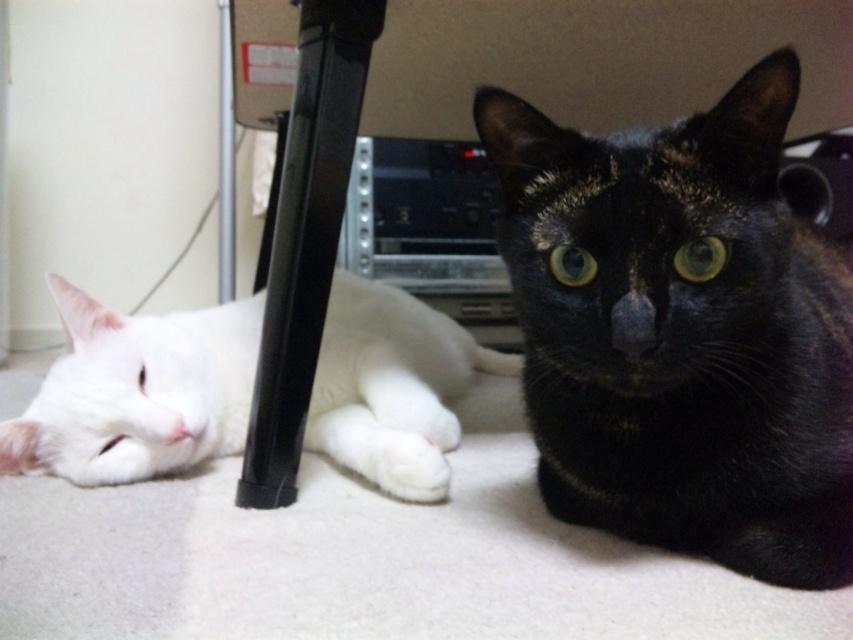
You are a photographer setting up a photo shoot for the black glossy cat at center and the white fluffy cat at left. Since you want both cats to be visible in the frame, which cat should you position closer to the camera to ensure they appear the same size?

The black glossy cat at center should be positioned closer to the camera because it occupies less space than the white fluffy cat at left, so moving it forward will make them appear similar in size.

In the scene shown: You are standing in the room and see the black glossy cat at center. Can you estimate its 2D coordinates in the image?

The 2D coordinates of the black glossy cat at center are at point (682,332).

You are a photographer trying to capture a clear photo of both the black glossy cat at center and the white fluffy cat at left. However, you notice an obstruction between them. Which cat is closer to the camera, making it more visible in the photo?

The black glossy cat at center is closer to the viewer than the white fluffy cat at left, so it will be more visible in the photo.